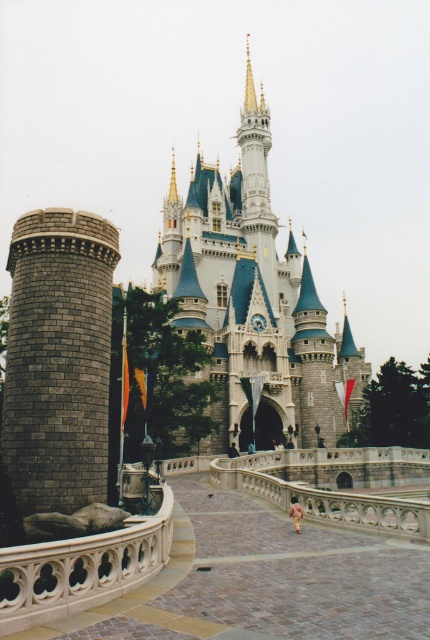
You are a knight approaching the castle from the front. As you walk towards the white stone castle at center, which direction should you turn to first see the gray brick tower at left?

Since the white stone castle at center is to the right of the gray brick tower at left, you should turn to your left to see the gray brick tower at left first.

In the scene shown: You are standing in front of the castle and notice two points marked on the image. The first point is at coordinates point (x=211, y=257) and the second is at point (x=76, y=340). Which point is closer to your eyes?

Point (x=211, y=257) is further to the camera than point (x=76, y=340), so the point closer to your eyes is point (x=76, y=340).

You are a tour guide standing at the base of the white stone castle at center. You want to inform visitors about the castle being within a safe viewing distance according to safety regulations. The regulation states that visitors must stay at least 100 meters away from the castle. Can you confirm if the current distance is compliant?

The white stone castle at center is 90.64 meters away from the camera, which is less than the required 100 meters safety distance. Therefore, the current distance does not comply with the safety regulations.